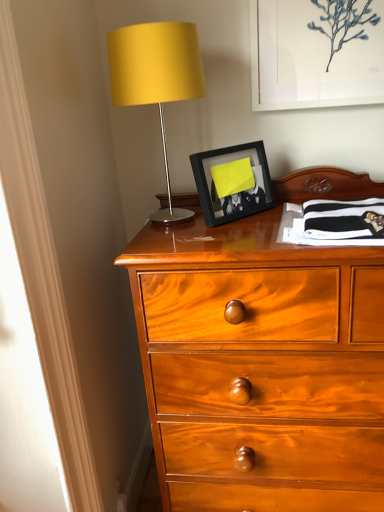
Question: From a real-world perspective, is black matte picture frame at center, which is the 1th picture frame in left-to-right order, on matte yellow fabric at upper left?

Choices:
 (A) no
 (B) yes

Answer: (A)

Question: Does black matte picture frame at center, which is the 1th picture frame in left-to-right order, touch matte yellow fabric at upper left?

Choices:
 (A) yes
 (B) no

Answer: (B)

Question: Is black matte picture frame at center, which is the 2th picture frame in top-to-bottom order, bigger than matte yellow fabric at upper left?

Choices:
 (A) yes
 (B) no

Answer: (B)

Question: Does black matte picture frame at center, which is the 2th picture frame in top-to-bottom order, appear on the left side of matte yellow fabric at upper left?

Choices:
 (A) yes
 (B) no

Answer: (B)

Question: Can you confirm if black matte picture frame at center, which is the 1th picture frame in left-to-right order, is smaller than matte yellow fabric at upper left?

Choices:
 (A) yes
 (B) no

Answer: (A)

Question: Considering the positions of point (150, 41) and point (367, 56), is point (150, 41) closer or farther from the camera than point (367, 56)?

Choices:
 (A) farther
 (B) closer

Answer: (B)

Question: In the image, is matte yellow fabric at upper left on the left side or the right side of white matte picture frame at upper center, the first picture frame viewed from the top?

Choices:
 (A) left
 (B) right

Answer: (A)

Question: In the image, is matte yellow fabric at upper left positioned in front of or behind white matte picture frame at upper center, which is the second picture frame from left to right?

Choices:
 (A) behind
 (B) front

Answer: (B)

Question: Looking at their shapes, would you say matte yellow fabric at upper left is wider or thinner than white matte picture frame at upper center, acting as the 1th picture frame starting from the right?

Choices:
 (A) wide
 (B) thin

Answer: (A)

Question: Considering the positions of point [140, 52] and point [210, 195], is point [140, 52] closer or farther from the camera than point [210, 195]?

Choices:
 (A) closer
 (B) farther

Answer: (A)

Question: Looking at the image, does matte yellow fabric at upper left seem bigger or smaller compared to black matte picture frame at center, which is the 2th picture frame in top-to-bottom order?

Choices:
 (A) small
 (B) big

Answer: (B)

Question: Looking at their shapes, would you say matte yellow fabric at upper left is wider or thinner than black matte picture frame at center, which is the 1th picture frame in left-to-right order?

Choices:
 (A) thin
 (B) wide

Answer: (B)

Question: Is matte yellow fabric at upper left in front of or behind black matte picture frame at center, positioned as the 1th picture frame in bottom-to-top order, in the image?

Choices:
 (A) behind
 (B) front

Answer: (B)

Question: From the image's perspective, is white matte picture frame at upper center, the first picture frame viewed from the top, positioned above or below black matte picture frame at center, which is the 1th picture frame in left-to-right order?

Choices:
 (A) above
 (B) below

Answer: (A)

Question: Does point (372, 93) appear closer or farther from the camera than point (213, 223)?

Choices:
 (A) closer
 (B) farther

Answer: (B)